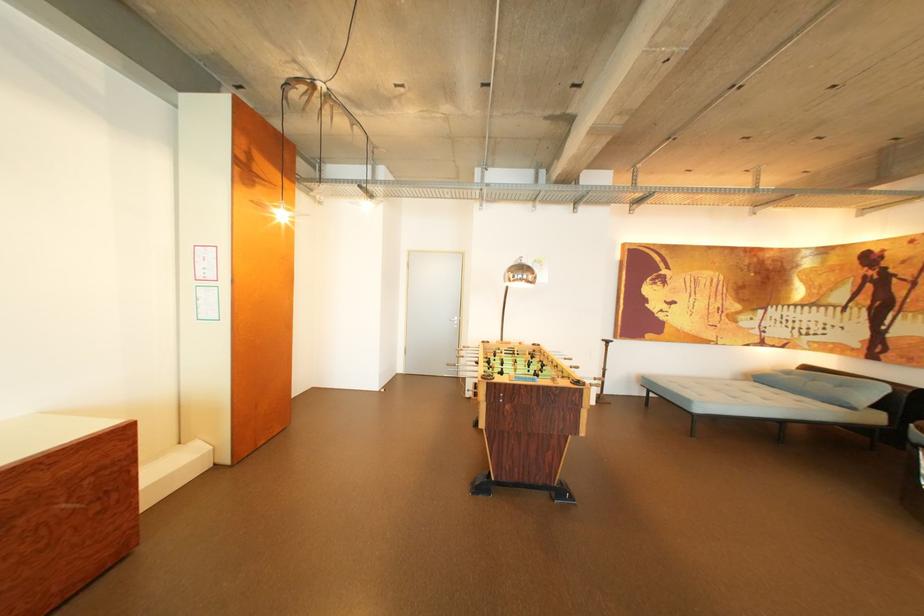
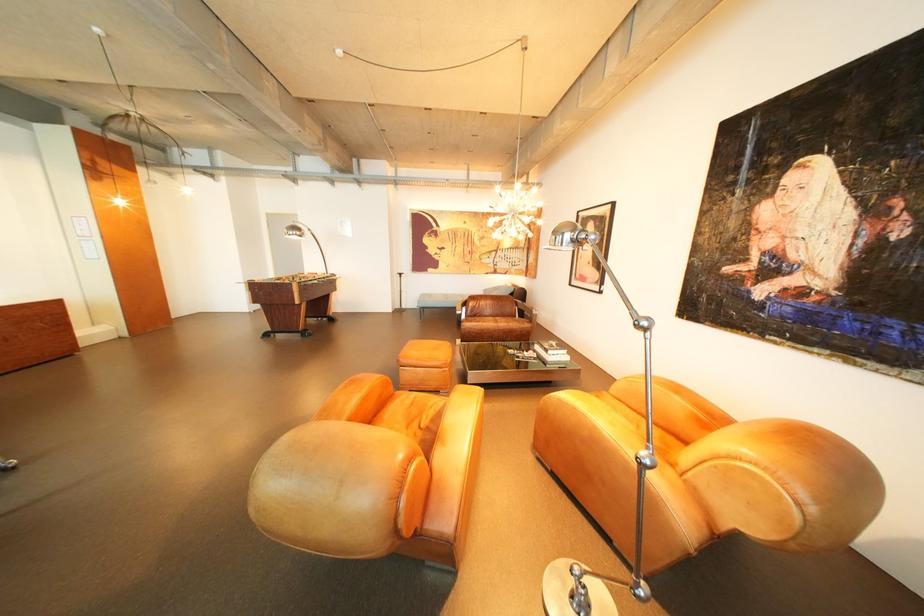
What movement of the cameraman would produce the second image?

The cameraman walked toward right, backward.